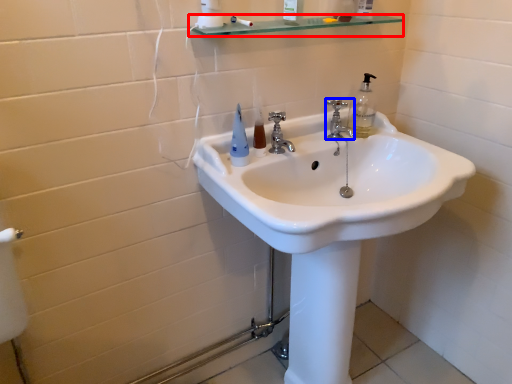
Question: Which of the following is the farthest to the observer, balustrade (highlighted by a red box) or tap (highlighted by a blue box)?

Choices:
 (A) balustrade
 (B) tap

Answer: (B)